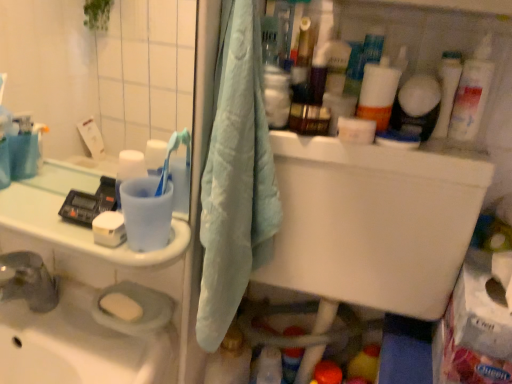
Question: Relative to white plastic tube at upper right, is white glossy cup at left in front or behind?

Choices:
 (A) behind
 (B) front

Answer: (B)

Question: Looking at the image, does white glossy cup at left seem bigger or smaller compared to white plastic tube at upper right?

Choices:
 (A) big
 (B) small

Answer: (A)

Question: Which of these objects is positioned farthest from the white glossy lotion at upper right, arranged as the 1th cleaning product when viewed from the right?

Choices:
 (A) yellow matte soap at lower left, the 2th soap from the front
 (B) white matte soap at left, which ranks as the 2th soap in bottom-to-top order
 (C) translucent plastic bottle at upper right, placed as the 2th cleaning product when sorted from top to bottom
 (D) green plastic toothbrush at upper left
 (E) white plastic tube at upper right

Answer: (A)

Question: Which of these objects is positioned closest to the white glossy cup at left?

Choices:
 (A) white matte soap at left, the 1th soap when ordered from front to back
 (B) light blue fabric towel at center
 (C) white plastic tube at upper right
 (D) green plastic toothbrush at upper left
 (E) translucent plastic bottle at upper right, placed as the 2th cleaning product when sorted from top to bottom

Answer: (A)